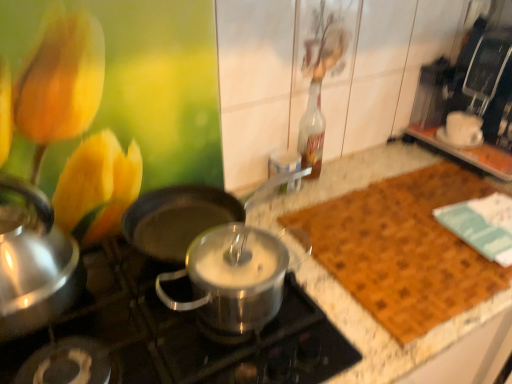
The image size is (512, 384). I want to click on vacant space to the right of translucent glass bottle at center, so click(x=361, y=171).